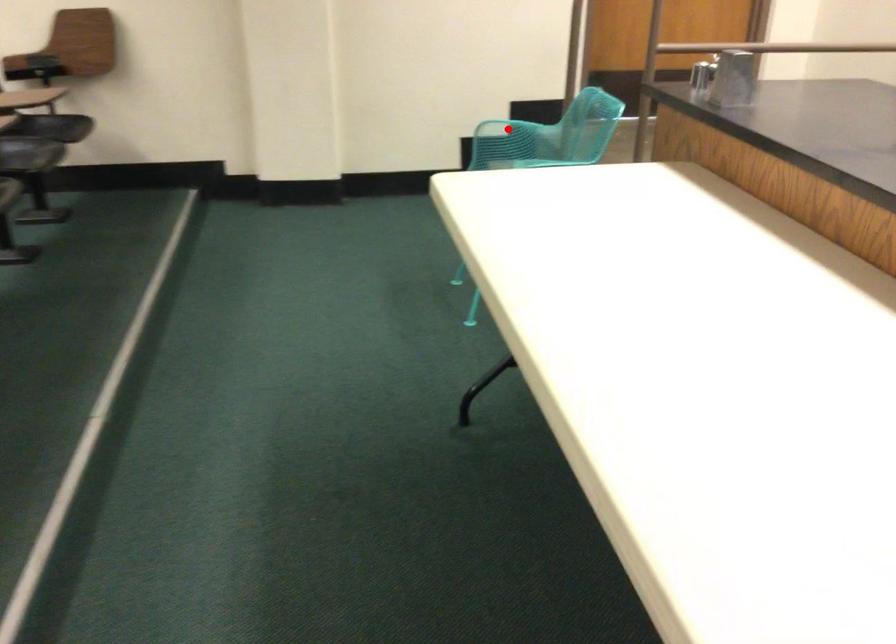
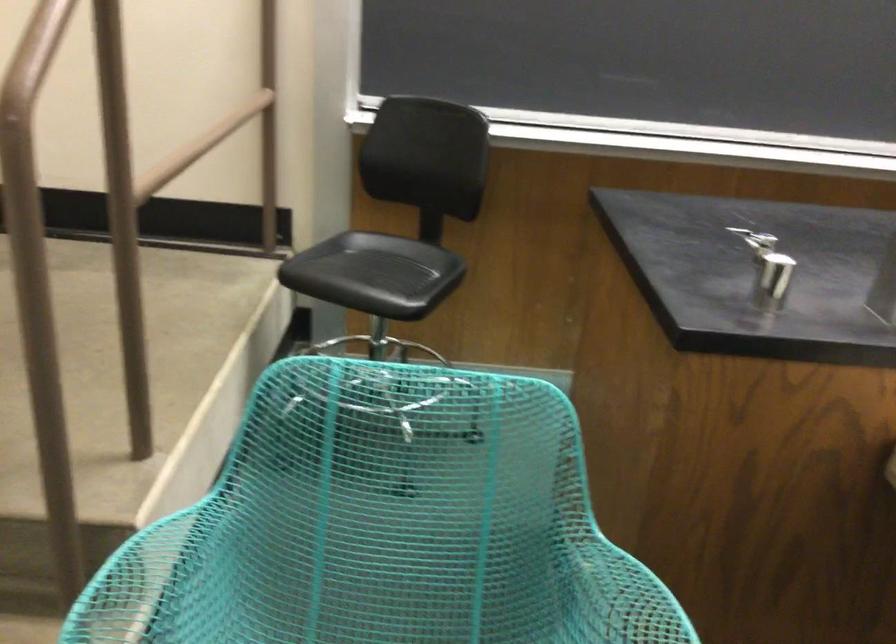
Question: I am providing you with two images of the same scene from different viewpoints. Image1 has a red point marked. In image2, the corresponding 3D location appears at what relative position? Reply with the corresponding letter.

Choices:
 (A) Closer
 (B) Farther

Answer: (A)